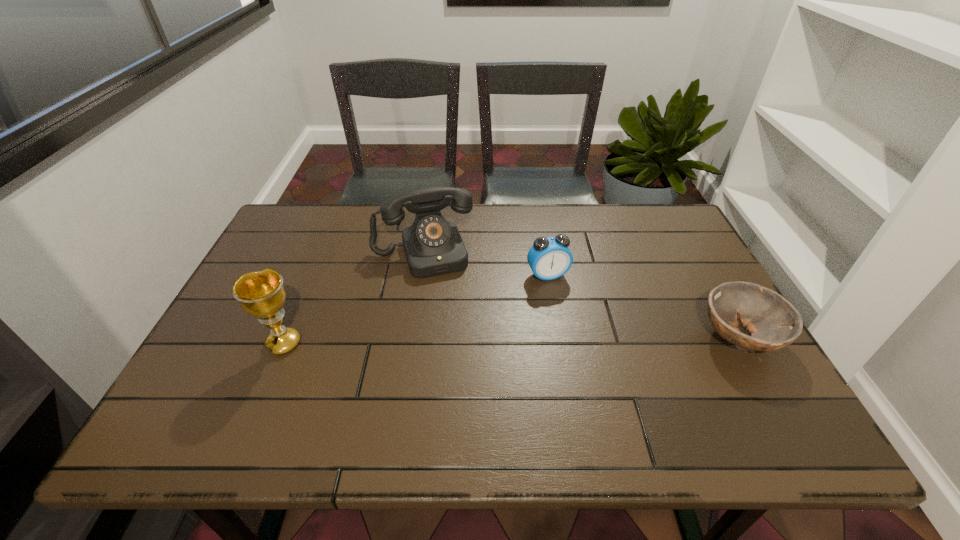
Locate an element on the screen. The image size is (960, 540). vacant space that is in between the telephone and the bowl is located at coordinates (581, 295).

You are a GUI agent. You are given a task and a screenshot of the screen. Output one action in this format:
    pyautogui.click(x=<x>, y=<y>)
    Task: Click on the free area in between the shortest object and the leftmost object
    Image resolution: width=960 pixels, height=540 pixels.
    Given the screenshot: What is the action you would take?
    pyautogui.click(x=512, y=340)

Where is `free spot between the alarm clock and the second object from left to right`? Image resolution: width=960 pixels, height=540 pixels. free spot between the alarm clock and the second object from left to right is located at coordinates coord(485,264).

Identify the location of free space between the leftmost object and the alarm clock. The width and height of the screenshot is (960, 540). (416, 309).

Where is `free space between the chalice and the telephone`? free space between the chalice and the telephone is located at coordinates (353, 298).

This screenshot has height=540, width=960. Identify the location of vacant point located between the shortest object and the alarm clock. (643, 306).

Locate which object is the second closest to the telephone. Please provide its 2D coordinates. Your answer should be formatted as a tuple, i.e. [(x, y)], where the tuple contains the x and y coordinates of a point satisfying the conditions above.

[(261, 294)]

In order to click on the third closest object relative to the third object from left to right in this screenshot , I will do `click(261, 294)`.

Locate an element on the screen. This screenshot has width=960, height=540. free spot that satisfies the following two spatial constraints: 1. on the back side of the chalice; 2. on the right side of the telephone is located at coordinates (322, 253).

What are the coordinates of `free region that satisfies the following two spatial constraints: 1. on the back side of the chalice; 2. on the right side of the bowl` in the screenshot? It's located at (286, 337).